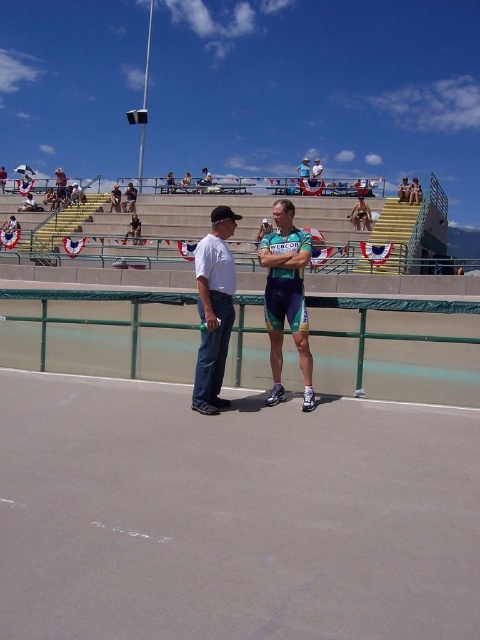
Question: From the image, what is the correct spatial relationship of green jersey at center in relation to white matte shirt at center?

Choices:
 (A) left
 (B) right

Answer: (B)

Question: Is gray asphalt race track at center to the left of yellow-green metal bleachers at upper center from the viewer's perspective?

Choices:
 (A) yes
 (B) no

Answer: (B)

Question: Which of the following is the farthest from the observer?

Choices:
 (A) [x=145, y=220]
 (B) [x=362, y=301]

Answer: (A)

Question: Can you confirm if green metal railing at center is positioned to the left of white matte shirt at center?

Choices:
 (A) yes
 (B) no

Answer: (A)

Question: Among these objects, which one is farthest from the camera?

Choices:
 (A) gray asphalt race track at center
 (B) green metal railing at center
 (C) yellow-green metal bleachers at upper center

Answer: (C)

Question: Considering the real-world distances, which object is closest to the gray asphalt race track at center?

Choices:
 (A) yellow-green metal bleachers at upper center
 (B) green jersey at center

Answer: (B)